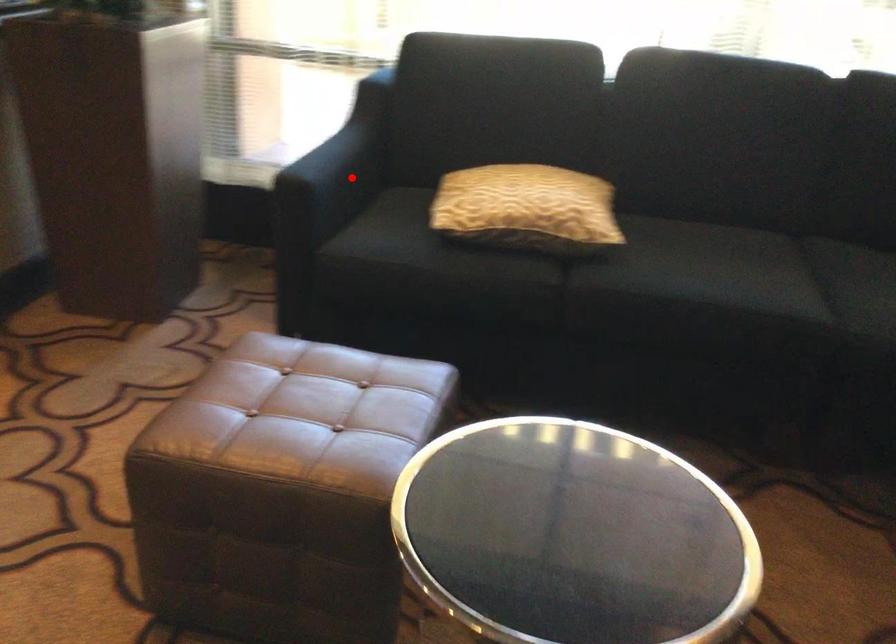
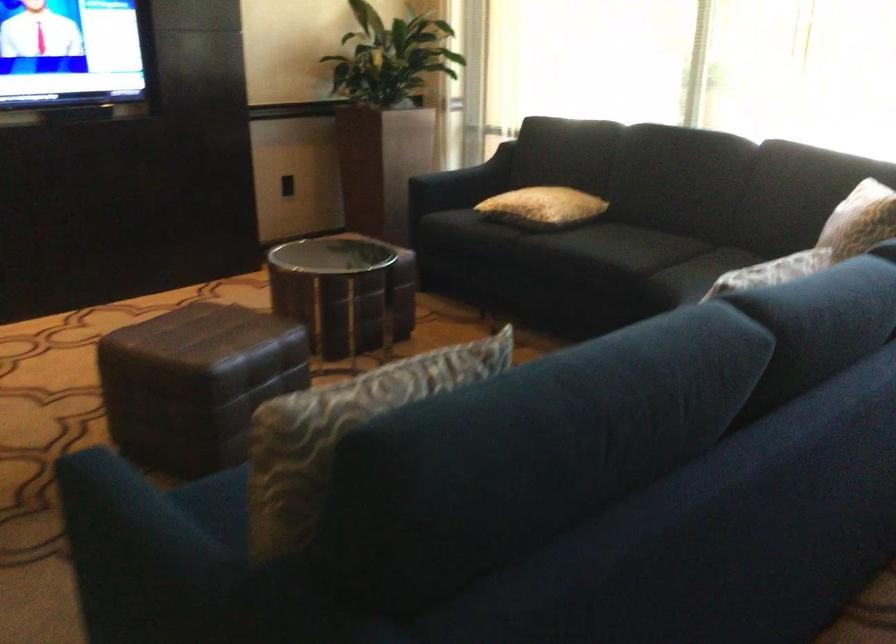
Locate, in the second image, the point that corresponds to the highlighted location in the first image.

(460, 184)